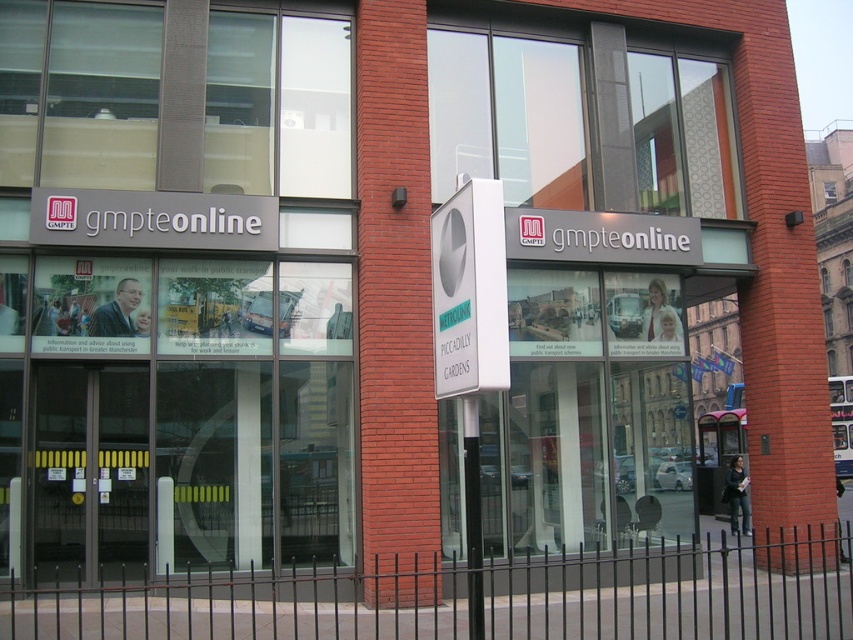
You are a visitor arriving at the GMPTeOnline office and see the white plastic sign at center and the black plastic pole at center. Which object is larger in size?

The white plastic sign at center is bigger than the black plastic pole at center.

You are standing in front of the GMPTeOnline office building. There is a point marked at coordinates (469, 291). Which object is this point located on?

The point is located on the white plastic sign at center.